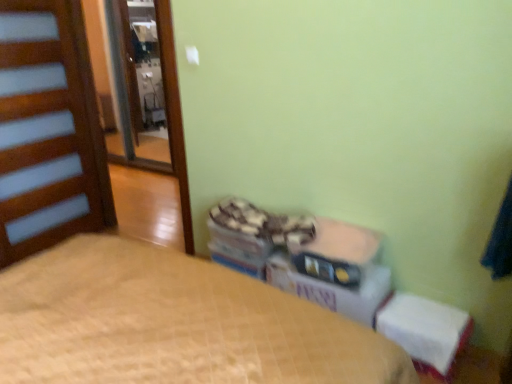
This screenshot has width=512, height=384. Find the location of `vacant region above white fabric changing table at lower right (from a real-world perspective)`. vacant region above white fabric changing table at lower right (from a real-world perspective) is located at coordinates (428, 314).